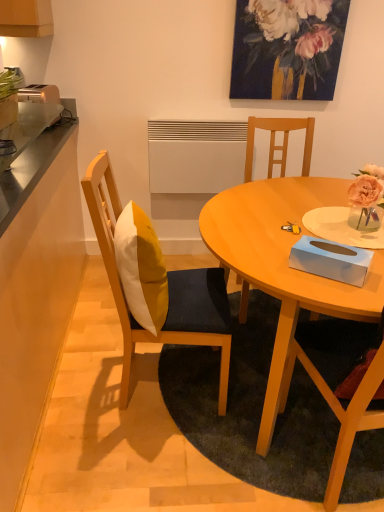
Locate an element on the screen. The width and height of the screenshot is (384, 512). free space below wooden chair with cushion at left, acting as the 1th chair starting from the left (from a real-world perspective) is located at coordinates (153, 377).